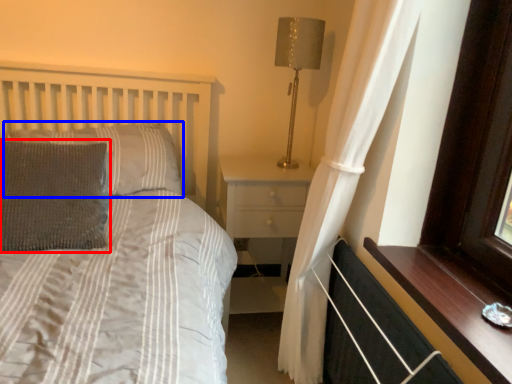
Question: Which point is closer to the camera, pillow (highlighted by a red box) or pillow (highlighted by a blue box)?

Choices:
 (A) pillow
 (B) pillow

Answer: (A)